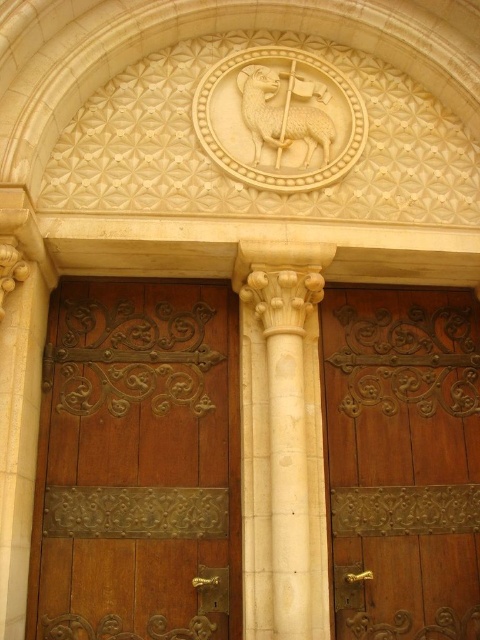
You are an architect analyzing the facade. Given that the brown wood door at center and the white stone column at center are both central elements, which one spans a smaller horizontal space?

The brown wood door at center has a lesser width compared to the white stone column at center, so it spans a smaller horizontal space.

Consider the image. You are an architect examining the facade. You notice the wooden door at center and the white stone column at center. Which object is positioned closer to your viewpoint?

The wooden door at center is closer to the viewer than the white stone column at center.